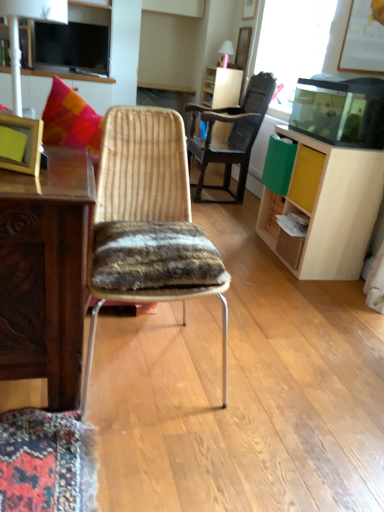
In order to click on free space that is in between light wood cabinet at right and woven wood chair at center, which appears as the second chair when viewed from the top in this screenshot , I will do `click(263, 303)`.